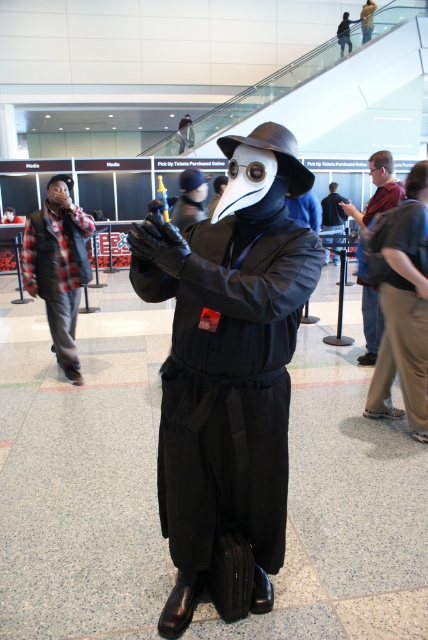
Is matte black backpack at center shorter than matte black mask at center?

Correct, matte black backpack at center is not as tall as matte black mask at center.

Is the position of matte black backpack at center more distant than that of matte black mask at center?

No, matte black backpack at center is closer to the viewer.

Describe the element at coordinates (379, 189) in the screenshot. This screenshot has height=640, width=428. I see `matte black backpack at center` at that location.

The width and height of the screenshot is (428, 640). I want to click on matte black backpack at center, so click(x=379, y=189).

Who is more forward, (64,333) or (332,189)?

Point (64,333) is in front.

Is plaid fabric shirt at left behind matte black mask at center?

No, plaid fabric shirt at left is in front of matte black mask at center.

Between point (76, 321) and point (329, 209), which one is positioned in front?

Point (76, 321) is in front.

Locate an element on the screen. plaid fabric shirt at left is located at coordinates (58, 266).

What do you see at coordinates (58, 266) in the screenshot?
I see `plaid fabric shirt at left` at bounding box center [58, 266].

Can you confirm if plaid fabric shirt at left is wider than matte black backpack at center?

Yes.

At what (x,y) coordinates should I click in order to perform the action: click on plaid fabric shirt at left. Please return your answer as a coordinate pair (x, y). The height and width of the screenshot is (640, 428). Looking at the image, I should click on (58, 266).

I want to click on plaid fabric shirt at left, so click(x=58, y=266).